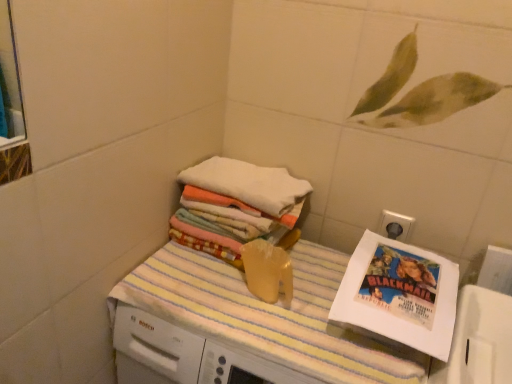
Question: Which is correct: white plastic electric outlet at upper right is inside white paper comic book at right, or outside of it?

Choices:
 (A) outside
 (B) inside

Answer: (A)

Question: From the image's perspective, relative to white paper comic book at right, is white plastic electric outlet at upper right above or below?

Choices:
 (A) below
 (B) above

Answer: (B)

Question: Which is farther from the white soft towels at upper center?

Choices:
 (A) white paper comic book at right
 (B) yellow striped towel at center
 (C) white plastic electric outlet at upper right

Answer: (C)

Question: Based on their relative distances, which object is nearer to the white paper comic book at right?

Choices:
 (A) white plastic electric outlet at upper right
 (B) white soft towels at upper center
 (C) yellow striped towel at center

Answer: (A)